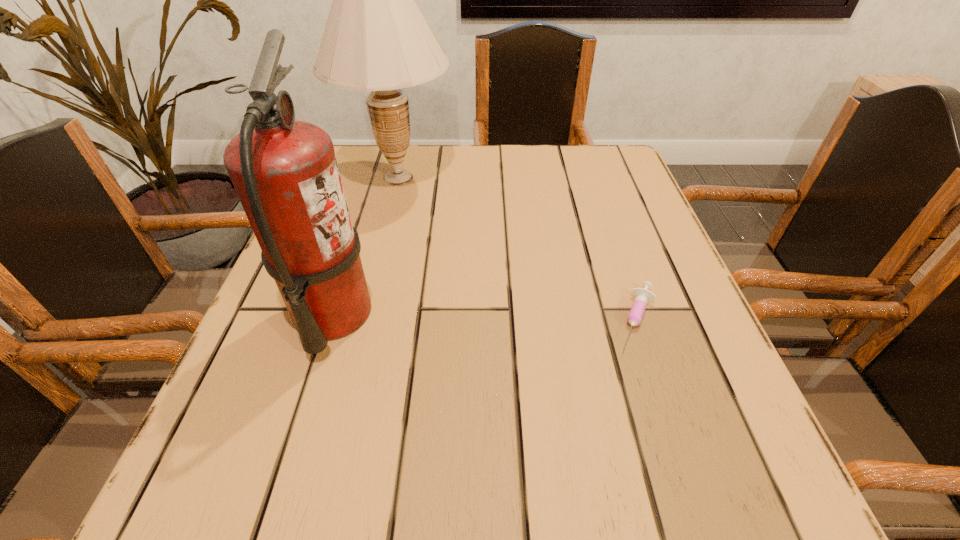
Locate an element on the screen. The height and width of the screenshot is (540, 960). object that is at the right edge is located at coordinates point(642,296).

Where is `object that is positioned at the far left corner`? object that is positioned at the far left corner is located at coordinates (376, 39).

Identify the location of vacant space at the far edge. (465, 181).

Find the location of a particular element. Image resolution: width=960 pixels, height=540 pixels. free space at the near edge of the desktop is located at coordinates (513, 507).

The width and height of the screenshot is (960, 540). I want to click on vacant space at the left edge of the desktop, so click(367, 207).

Where is `blank area at the right edge`? Image resolution: width=960 pixels, height=540 pixels. blank area at the right edge is located at coordinates (647, 272).

This screenshot has height=540, width=960. Find the location of `blank space at the far left corner of the desktop`. blank space at the far left corner of the desktop is located at coordinates (363, 182).

Find the location of a particular element. This screenshot has height=540, width=960. free region at the near left corner is located at coordinates (205, 514).

Find the location of `vacant area at the far right corner`. vacant area at the far right corner is located at coordinates (607, 193).

Find the location of a particular element. This screenshot has width=960, height=540. free space at the near right corner of the desktop is located at coordinates (785, 525).